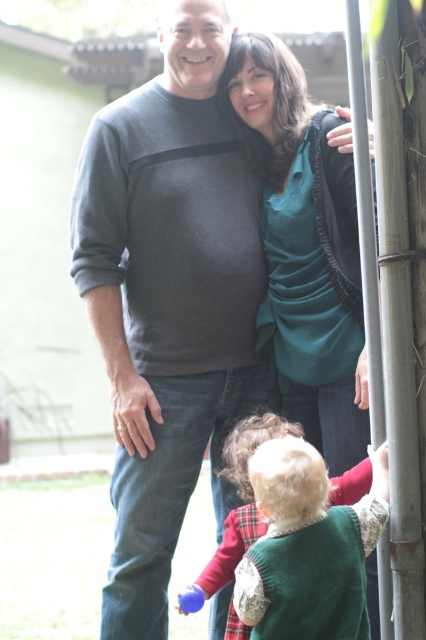
You are trying to decide which clothing item to take for a hike. The gray cotton sweater at center and the green fuzzy vest at lower center are both options. Based on their sizes, which one might be more suitable for layering under a backpack?

The gray cotton sweater at center has a greater height compared to the green fuzzy vest at lower center, so it might be more suitable for layering under a backpack as it covers more of the torso.

What is the color of the object located at the coordinates point (169, 300)?

The object located at point (169, 300) is a gray cotton sweater at center.

You are a photographer trying to capture a closeup of the teal satin blouse at center and the rubber blue ball at lower center. Since you can only focus on one object at a time, which one should you choose to ensure it appears clearer in the photo?

You should focus on the teal satin blouse at center because it is larger in size than the rubber blue ball at lower center, making it easier to capture a clear closeup.